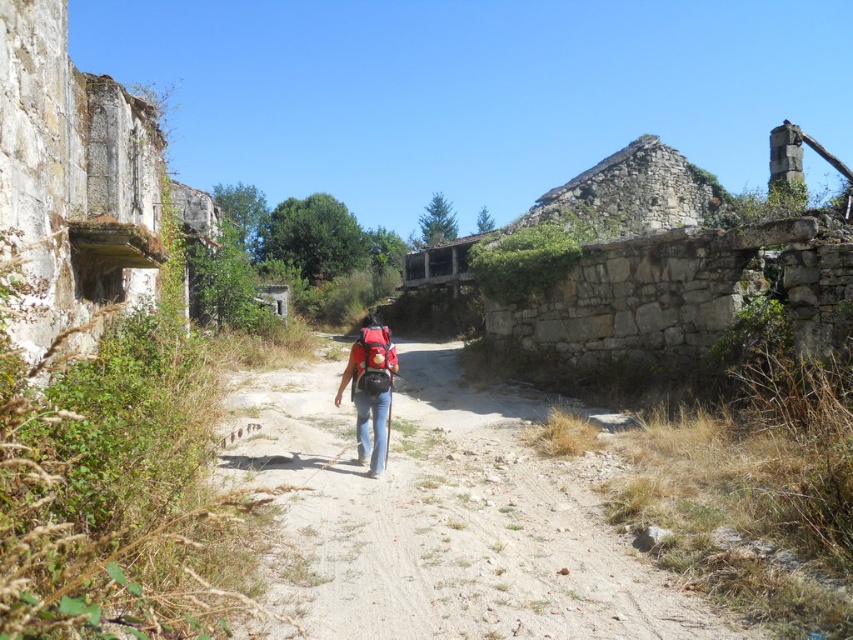
Does dusty gravel path at center have a lesser width compared to red backpack at center?

In fact, dusty gravel path at center might be wider than red backpack at center.

Is dusty gravel path at center in front of red backpack at center?

Yes, dusty gravel path at center is in front of red backpack at center.

Where is `dusty gravel path at center`? The image size is (853, 640). dusty gravel path at center is located at coordinates (445, 518).

Where is `dusty gravel path at center`? dusty gravel path at center is located at coordinates (445, 518).

Is dusty gravel path at center positioned at the back of matte black backpack at center?

That is False.

Who is more distant from viewer, (328, 372) or (358, 381)?

The point (328, 372) is more distant.

Where is `dusty gravel path at center`? dusty gravel path at center is located at coordinates (445, 518).

Can you confirm if red backpack at center is smaller than matte black backpack at center?

No, red backpack at center is not smaller than matte black backpack at center.

Does red backpack at center appear under matte black backpack at center?

No.

The image size is (853, 640). Find the location of `red backpack at center`. red backpack at center is located at coordinates (370, 388).